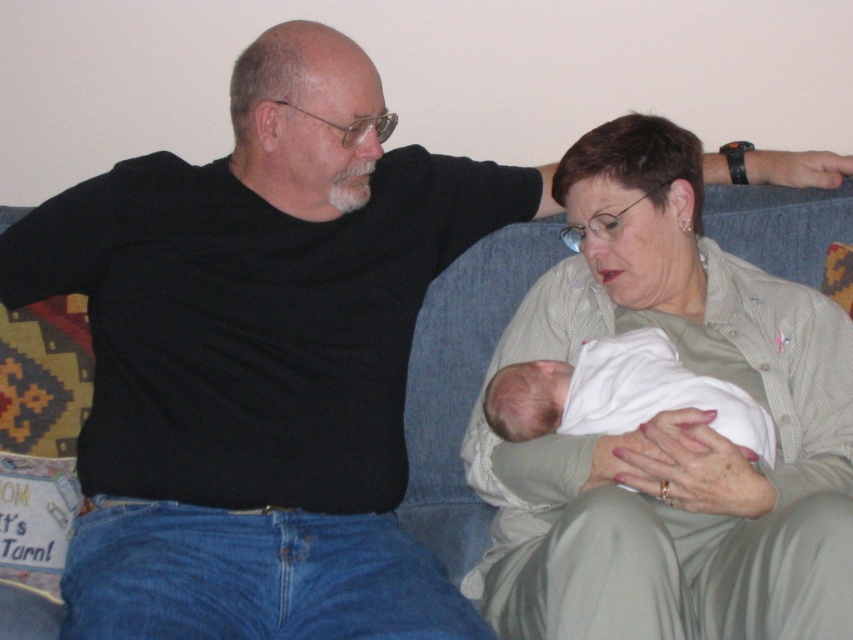
Can you confirm if light green textured shirt at center is positioned below white soft cloth at center?

No.

Describe the element at coordinates (664, 424) in the screenshot. The width and height of the screenshot is (853, 640). I see `light green textured shirt at center` at that location.

The width and height of the screenshot is (853, 640). What do you see at coordinates (664, 424) in the screenshot? I see `light green textured shirt at center` at bounding box center [664, 424].

This screenshot has height=640, width=853. What are the coordinates of `light green textured shirt at center` in the screenshot? It's located at (664, 424).